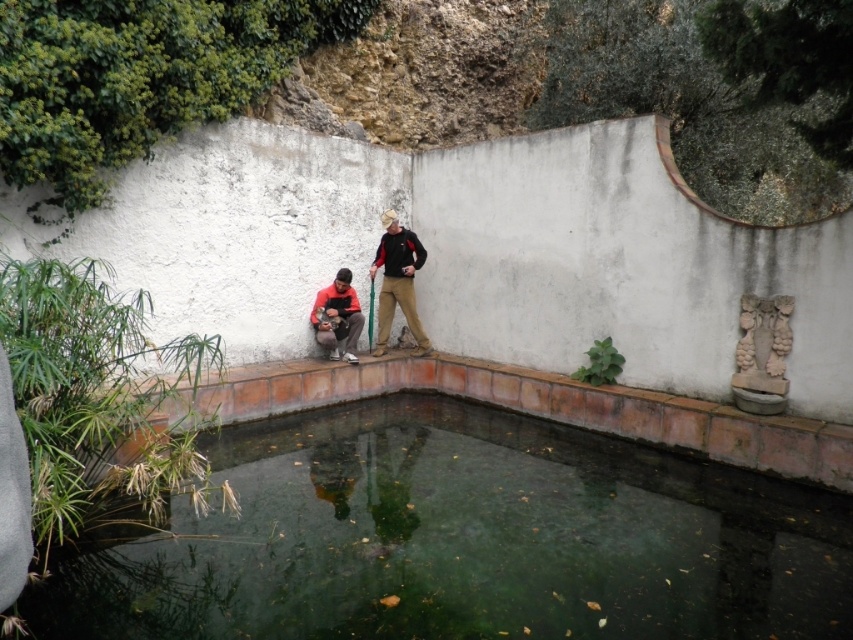
Question: Which object is positioned closest to the terracotta tile ledge at center?

Choices:
 (A) matte black jacket at center
 (B) matte orange jacket at lower center
 (C) green smooth water at center

Answer: (B)

Question: Is the position of terracotta tile ledge at center less distant than that of matte black jacket at center?

Choices:
 (A) no
 (B) yes

Answer: (B)

Question: Does terracotta tile ledge at center appear on the left side of matte black jacket at center?

Choices:
 (A) no
 (B) yes

Answer: (B)

Question: Which object is positioned closest to the green smooth water at center?

Choices:
 (A) matte black jacket at center
 (B) terracotta tile ledge at center
 (C) matte orange jacket at lower center

Answer: (B)

Question: Does green smooth water at center have a larger size compared to matte orange jacket at lower center?

Choices:
 (A) yes
 (B) no

Answer: (A)

Question: Which point is closer to the camera?

Choices:
 (A) matte orange jacket at lower center
 (B) matte black jacket at center
 (C) green smooth water at center

Answer: (C)